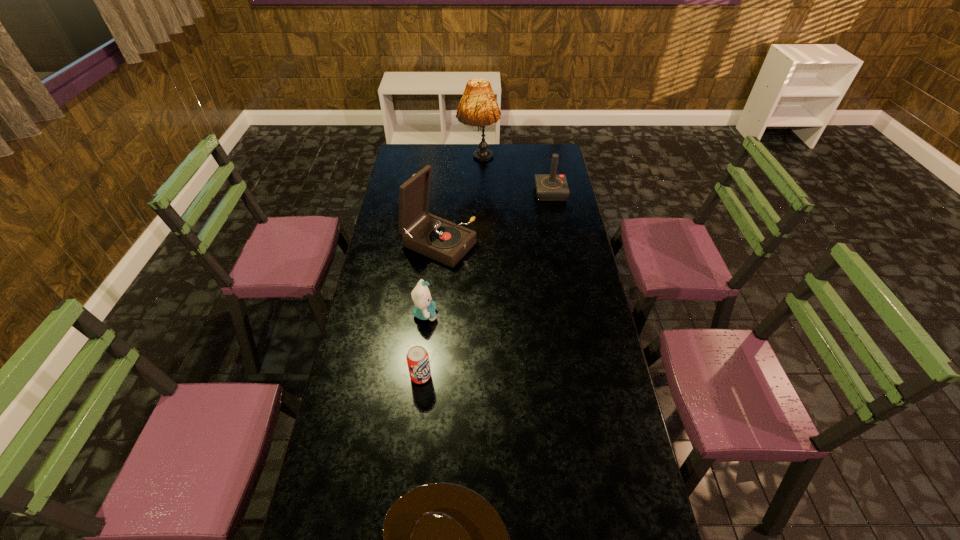
At what (x,y) coordinates should I click in order to perform the action: click on blank space at the right edge. Please return your answer as a coordinate pair (x, y). This screenshot has height=540, width=960. Looking at the image, I should click on (566, 229).

Identify the location of vacant space at the far left corner of the desktop. coord(414,147).

Where is `free space between the joystick and the phonograph record`? The image size is (960, 540). free space between the joystick and the phonograph record is located at coordinates (494, 218).

Image resolution: width=960 pixels, height=540 pixels. What are the coordinates of `vacant region between the lampshade and the fourth nearest object` in the screenshot? It's located at (459, 204).

In order to click on vacant space that's between the fifth farthest object and the lampshade in this screenshot , I will do `click(449, 270)`.

At what (x,y) coordinates should I click in order to perform the action: click on empty location between the phonograph record and the kitten. Please return your answer as a coordinate pair (x, y). Looking at the image, I should click on (432, 279).

Where is `empty space that is in between the soda can and the lampshade`? The image size is (960, 540). empty space that is in between the soda can and the lampshade is located at coordinates (449, 270).

The width and height of the screenshot is (960, 540). Find the location of `free space between the tallest object and the second nearest object`. free space between the tallest object and the second nearest object is located at coordinates (449, 270).

Where is `vacant area between the lampshade and the second tallest object`? vacant area between the lampshade and the second tallest object is located at coordinates (459, 204).

This screenshot has width=960, height=540. In order to click on the second closest object to the phonograph record in this screenshot , I will do `click(549, 187)`.